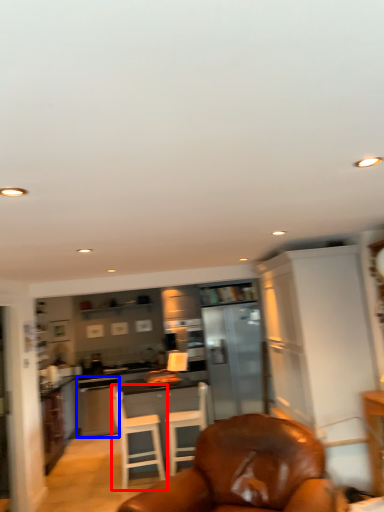
Question: Among these objects, which one is nearest to the camera, chair (highlighted by a red box) or dish washer (highlighted by a blue box)?

Choices:
 (A) chair
 (B) dish washer

Answer: (A)